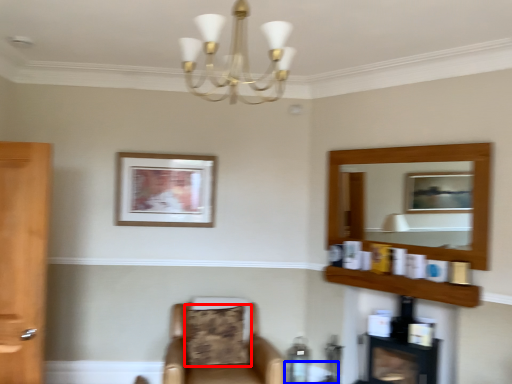
Question: Among these objects, which one is farthest to the camera, pillow (highlighted by a red box) or round table (highlighted by a blue box)?

Choices:
 (A) pillow
 (B) round table

Answer: (B)